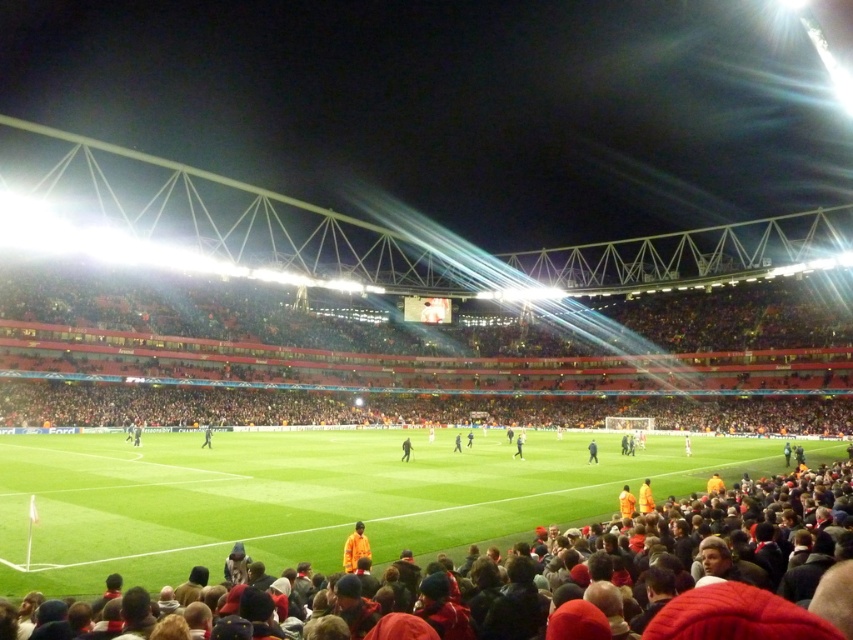
You are a photographer at the football stadium and want to capture a photo of the black fabric person at center without the dark blue fabric jacket at center appearing in the foreground. Is this possible based on their positions?

The dark blue fabric jacket at center is located above the black fabric person at center, so it will appear in the foreground of the photo. Therefore, it is not possible to capture the black fabric person at center without the dark blue fabric jacket at center in the foreground.

You are a spectator at the football stadium and want to locate the dark brown leather jacket at center. Based on the coordinates provided, where should you look relative to the field?

The dark brown leather jacket at center is located at point coordinates 0.703 on the x and 0.477 on the y axis. Since the coordinates are relative to the image, you should look towards the center area slightly to the right and above the center point of the field.

You are a photographer standing at the edge of the football field. You want to take a photo of the dark blue fabric jacket at center. Where should you aim your camera to capture it?

You should aim your camera at the point with coordinates 0.708 on the x axis and 0.695 on the y axis to capture the dark blue fabric jacket at center.